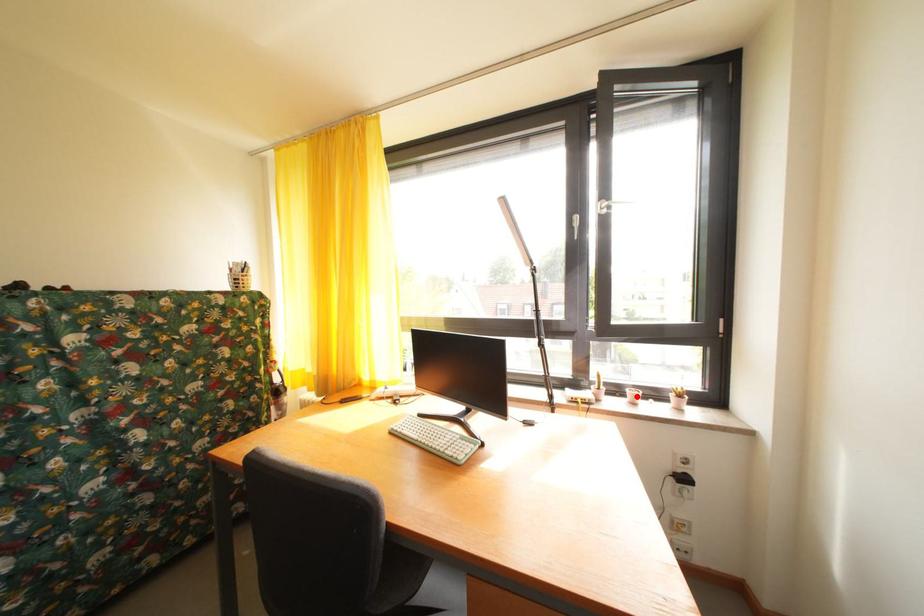
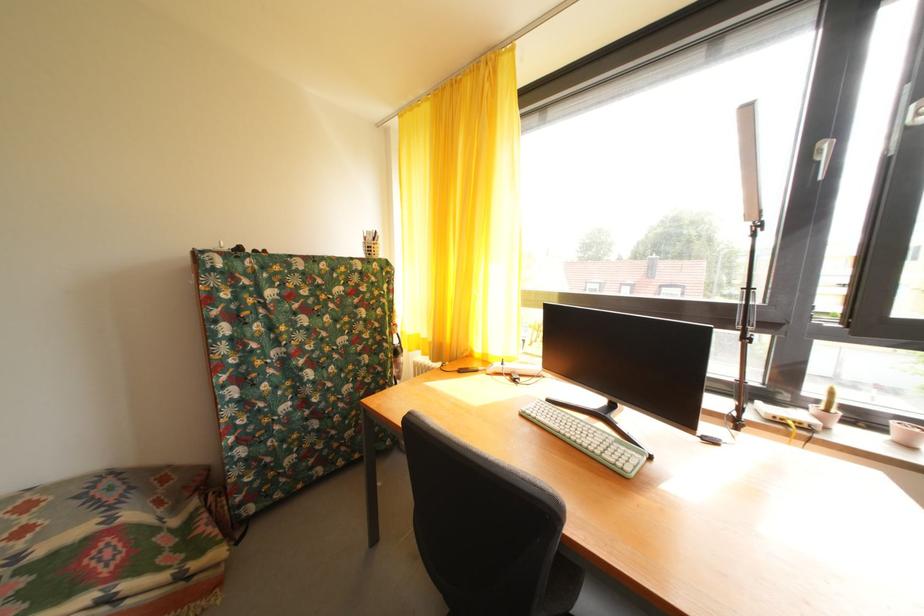
Question: I am providing you with two images of the same scene from different viewpoints. Given a red point in image1, look at the same physical point in image2. Is it:

Choices:
 (A) Closer to the viewpoint
 (B) Farther from the viewpoint

Answer: (A)